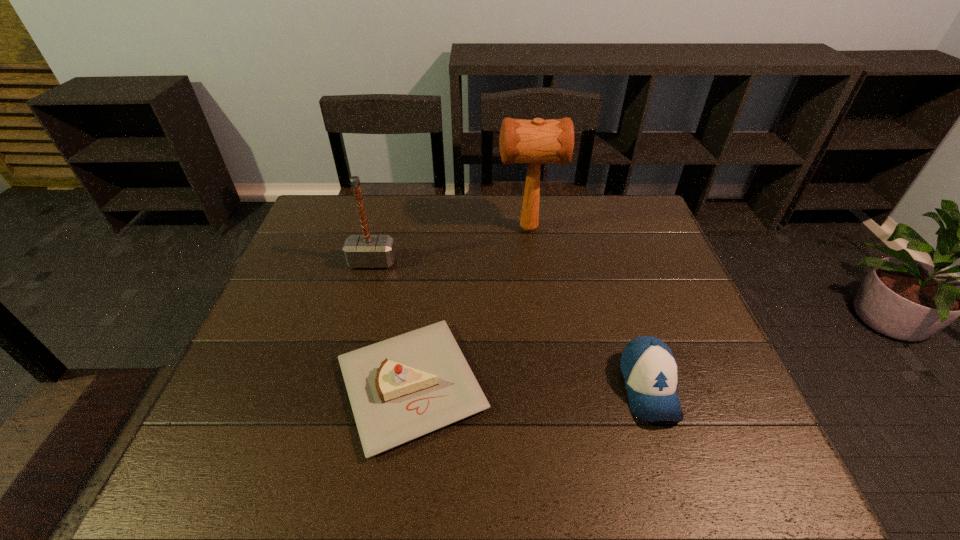
Image resolution: width=960 pixels, height=540 pixels. I want to click on free space located 0.050m on the striking surface of the second farthest object, so (x=367, y=283).

What are the coordinates of `free region located 0.280m on the back of the shortest object` in the screenshot? It's located at (429, 254).

This screenshot has width=960, height=540. I want to click on object located at the far edge, so click(536, 141).

The height and width of the screenshot is (540, 960). In order to click on object at the near edge in this screenshot , I will do `click(402, 388)`.

Find the location of `object that is at the right edge`. object that is at the right edge is located at coordinates (649, 369).

Image resolution: width=960 pixels, height=540 pixels. I want to click on vacant point at the far edge, so click(558, 214).

Locate an element on the screen. The image size is (960, 540). vacant space at the left edge of the desktop is located at coordinates (223, 413).

Where is `vacant space at the right edge of the desktop`? vacant space at the right edge of the desktop is located at coordinates (687, 369).

Identify the location of blank space at the far left corner of the desktop. (304, 224).

Find the location of a particular element. The height and width of the screenshot is (540, 960). vacant space at the far right corner is located at coordinates (619, 197).